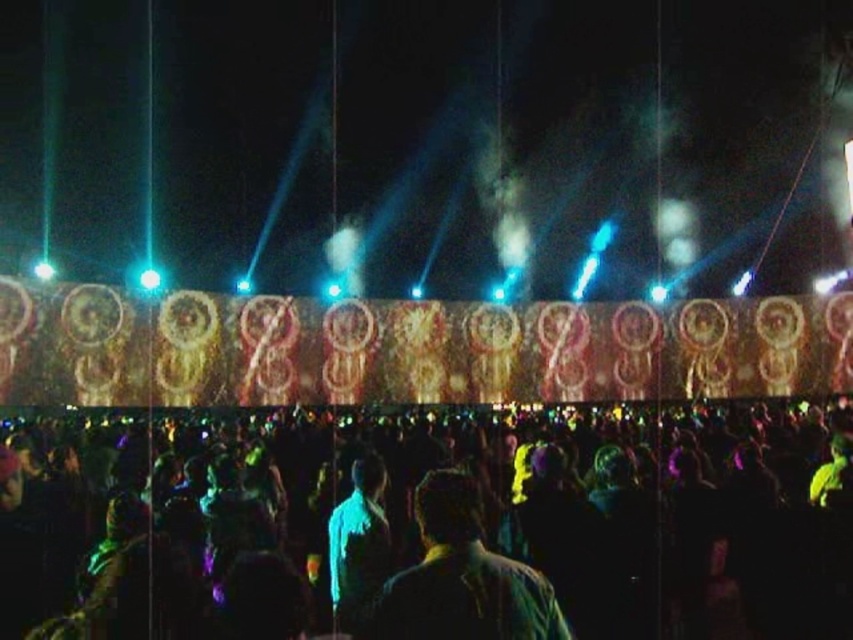
Question: In this image, where is dark fabric shirt at center located relative to blue fabric at center?

Choices:
 (A) below
 (B) above

Answer: (A)

Question: Among these points, which one is farthest from the camera?

Choices:
 (A) (x=366, y=636)
 (B) (x=534, y=582)
 (C) (x=358, y=477)

Answer: (C)

Question: Is dark fabric shirt at center below blue fabric at center?

Choices:
 (A) yes
 (B) no

Answer: (A)

Question: Estimate the real-world distances between objects in this image. Which object is closer to the black fabric crowd at lower center?

Choices:
 (A) dark fabric shirt at center
 (B) blue fabric at center

Answer: (A)

Question: Can you confirm if black fabric crowd at lower center is wider than dark fabric shirt at center?

Choices:
 (A) no
 (B) yes

Answer: (B)

Question: Which object is farther from the camera taking this photo?

Choices:
 (A) dark fabric shirt at center
 (B) blue fabric at center
 (C) black fabric crowd at lower center

Answer: (B)